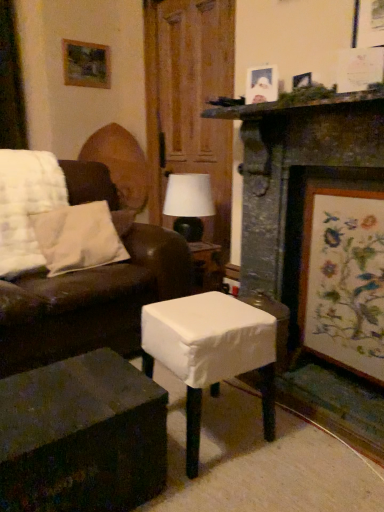
Question: From a real-world perspective, is wooden door at center above or below dark wood table at lower left, positioned as the 2th table in right-to-left order?

Choices:
 (A) above
 (B) below

Answer: (A)

Question: From the image's perspective, is wooden door at center located above or below dark wood table at lower left, positioned as the 2th table in right-to-left order?

Choices:
 (A) above
 (B) below

Answer: (A)

Question: Based on their relative distances, which object is nearer to the dark wood table at lower left, positioned as the 2th table in right-to-left order?

Choices:
 (A) wooden door at center
 (B) wooden picture frame at upper left, which is the 1th picture frame in top-to-bottom order
 (C) white cotton pillow at left
 (D) matte white picture frame at upper right, which is counted as the second picture frame, starting from the right
 (E) white matte table lamp at center

Answer: (C)

Question: Which object is the closest to the matte white picture frame at upper right, which is counted as the second picture frame, starting from the right?

Choices:
 (A) white matte table lamp at center
 (B) wooden framed artwork at right, the third picture frame when ordered from left to right
 (C) stone fireplace at center
 (D) dark wood table at lower left, marked as the first table in a left-to-right arrangement
 (E) white fabric-covered stool at center, which ranks as the first table in right-to-left order

Answer: (C)